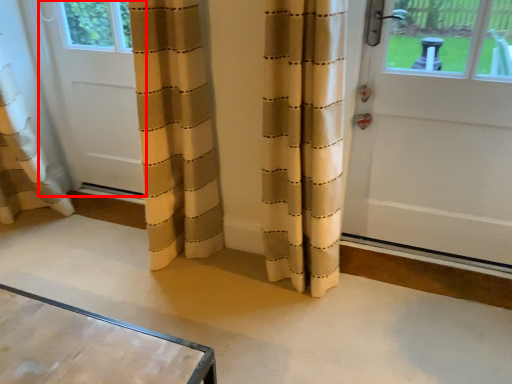
Question: Considering the relative positions of door (annotated by the red box) and door in the image provided, where is door (annotated by the red box) located with respect to the staircase?

Choices:
 (A) right
 (B) left

Answer: (B)